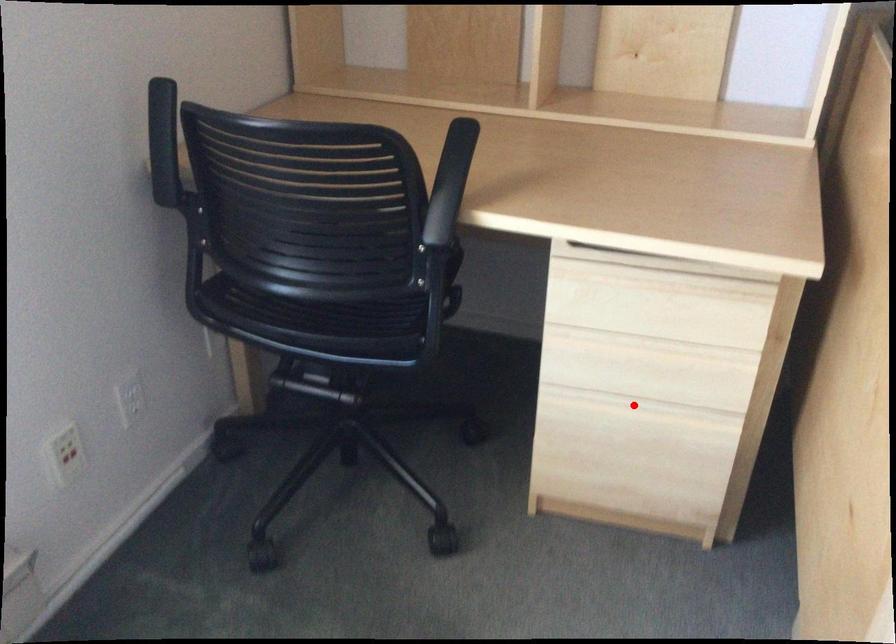
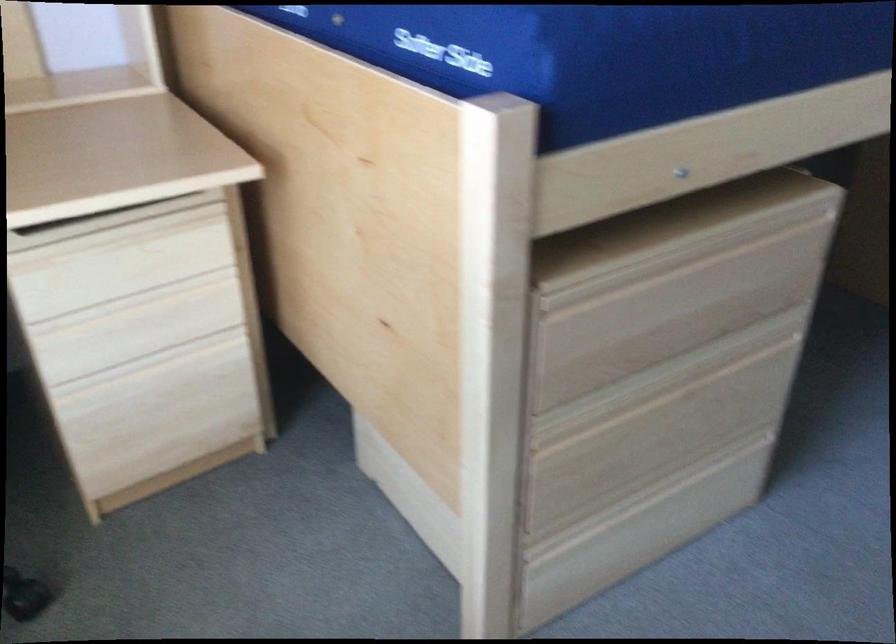
Locate, in the second image, the point that corresponds to the highlighted location in the first image.

(152, 361)